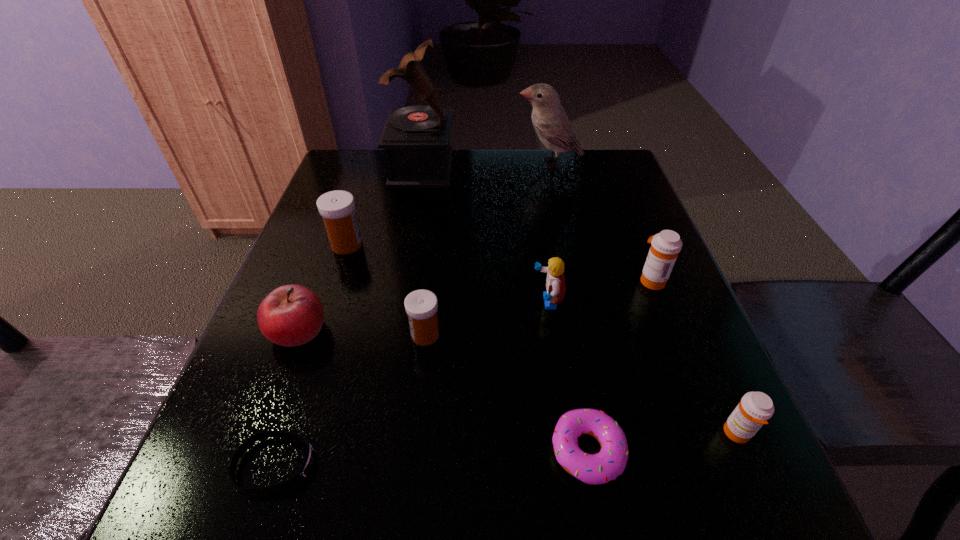
The image size is (960, 540). In order to click on the second nearest medicine in this screenshot , I will do `click(421, 306)`.

Locate an element on the screen. the nearer orange medicine is located at coordinates (755, 408).

Locate an element on the screen. The height and width of the screenshot is (540, 960). the nearest medicine is located at coordinates (755, 408).

Where is `doughnut`? doughnut is located at coordinates (610, 462).

You are a GUI agent. You are given a task and a screenshot of the screen. Output one action in this format:
    pyautogui.click(x=<x>, y=<y>)
    Task: Click on the pink doughnut
    
    Given the screenshot: What is the action you would take?
    pyautogui.click(x=610, y=462)

Where is `the shortest object`? The height and width of the screenshot is (540, 960). the shortest object is located at coordinates (309, 458).

The height and width of the screenshot is (540, 960). Find the location of `vacant area situated 0.280m at the horn opening of the tallest object`. vacant area situated 0.280m at the horn opening of the tallest object is located at coordinates (553, 168).

Locate an element on the screen. free spot located 0.200m at the face of the ninth shortest object is located at coordinates (444, 163).

The height and width of the screenshot is (540, 960). Find the location of `free space located at the face of the ninth shortest object`. free space located at the face of the ninth shortest object is located at coordinates (498, 163).

At what (x,y) coordinates should I click in order to perform the action: click on vacant space situated at the face of the ninth shortest object. Please return your answer as a coordinate pair (x, y). Looking at the image, I should click on (442, 163).